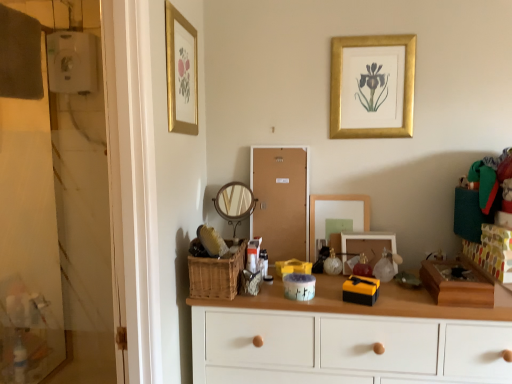
You are a GUI agent. You are given a task and a screenshot of the screen. Output one action in this format:
    pyautogui.click(x=<x>, y=<y>)
    Task: Click on the free location in front of shiny metallic toy at center
    The height and width of the screenshot is (384, 512).
    Given the screenshot: What is the action you would take?
    pyautogui.click(x=386, y=300)